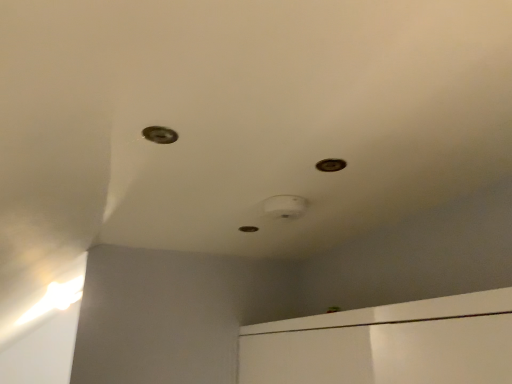
Question: Which direction should I rotate to look at metallic hole at center, which appears as the third hole when viewed from the top?

Choices:
 (A) right
 (B) left

Answer: (B)

Question: Can you confirm if metallic hole at center, which is the first hole in back-to-front order, is positioned to the left of metallic circular hole at upper center, the 1th hole in the right-to-left sequence?

Choices:
 (A) no
 (B) yes

Answer: (B)

Question: Can you confirm if metallic hole at center, which is the first hole in back-to-front order, is bigger than metallic circular hole at upper center, which appears as the 2th hole when viewed from the top?

Choices:
 (A) yes
 (B) no

Answer: (A)

Question: Is metallic hole at center, the second hole when ordered from right to left, positioned with its back to metallic circular hole at upper center, which is the second hole from bottom to top?

Choices:
 (A) yes
 (B) no

Answer: (B)

Question: From a real-world perspective, is metallic hole at center, which is the first hole in back-to-front order, located beneath metallic circular hole at upper center, which is the second hole from bottom to top?

Choices:
 (A) yes
 (B) no

Answer: (B)

Question: Does metallic hole at center, which appears as the second hole when viewed from the left, have a greater height compared to metallic circular hole at upper center, which is the second hole from bottom to top?

Choices:
 (A) yes
 (B) no

Answer: (A)

Question: Does metallic hole at center, which is the first hole from bottom to top, have a lesser height compared to metallic circular hole at upper center, the second hole in the front-to-back sequence?

Choices:
 (A) yes
 (B) no

Answer: (B)

Question: Is metallic circular hole at upper left, which ranks as the 1th hole in front-to-back order, at the right side of metallic hole at center, which is the first hole in back-to-front order?

Choices:
 (A) no
 (B) yes

Answer: (A)

Question: Is metallic circular hole at upper left, the 3th hole in the back-to-front sequence, far away from metallic hole at center, which is the first hole from bottom to top?

Choices:
 (A) no
 (B) yes

Answer: (A)

Question: Considering the relative sizes of metallic circular hole at upper left, placed as the 1th hole when sorted from left to right, and metallic hole at center, which appears as the second hole when viewed from the left, in the image provided, is metallic circular hole at upper left, placed as the 1th hole when sorted from left to right, taller than metallic hole at center, which appears as the second hole when viewed from the left,?

Choices:
 (A) no
 (B) yes

Answer: (A)

Question: Does metallic circular hole at upper left, which ranks as the 1th hole in front-to-back order, have a lesser width compared to metallic hole at center, which appears as the third hole when viewed from the front?

Choices:
 (A) yes
 (B) no

Answer: (A)

Question: Does metallic circular hole at upper left, which ranks as the 1th hole in front-to-back order, have a greater width compared to metallic hole at center, which is the first hole in back-to-front order?

Choices:
 (A) yes
 (B) no

Answer: (B)

Question: Is metallic circular hole at upper left, the 3th hole in the bottom-to-top sequence, closer to camera compared to metallic hole at center, which is the first hole in back-to-front order?

Choices:
 (A) no
 (B) yes

Answer: (B)

Question: Is metallic circular hole at upper center, which is the second hole from bottom to top, closer to camera compared to metallic hole at center, which appears as the third hole when viewed from the front?

Choices:
 (A) no
 (B) yes

Answer: (B)